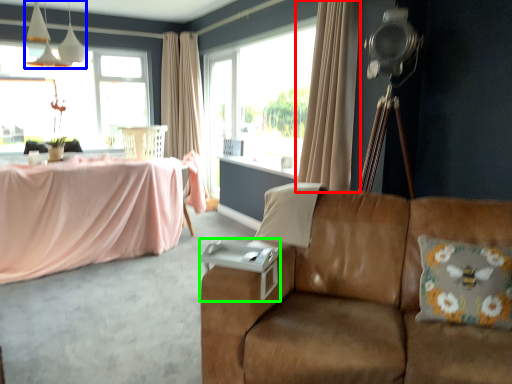
Question: Considering the real-world distances, which object is closest to curtain (highlighted by a red box)? fixture (highlighted by a blue box) or side table (highlighted by a green box).

Choices:
 (A) fixture
 (B) side table

Answer: (B)